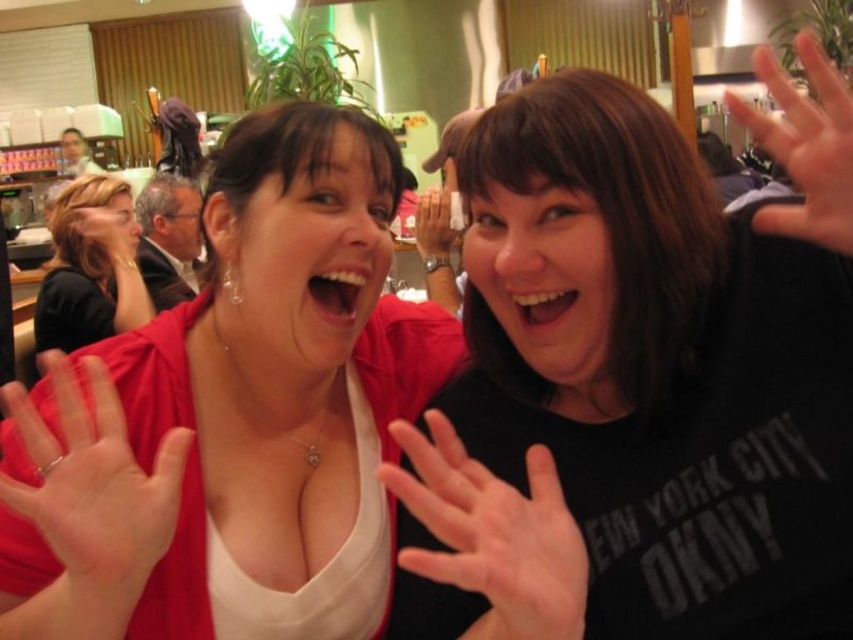
Question: Is matte red cardigan at center below matte black hand at upper right?

Choices:
 (A) no
 (B) yes

Answer: (B)

Question: Which is farther from the matte black hand at upper right?

Choices:
 (A) pale skin flesh at center
 (B) white matte hand at center

Answer: (A)

Question: Is matte red cardigan at center to the right of pale skin flesh at center from the viewer's perspective?

Choices:
 (A) no
 (B) yes

Answer: (B)

Question: Does matte red cardigan at center lie behind matte black hair at upper left?

Choices:
 (A) no
 (B) yes

Answer: (A)

Question: Which object is closer to the camera taking this photo?

Choices:
 (A) matte black hand at upper right
 (B) matte black hand at center
 (C) matte black hair at upper left
 (D) black matte shirt at center

Answer: (D)

Question: Which of the following is the closest to the observer?

Choices:
 (A) (436, 243)
 (B) (345, 408)

Answer: (B)